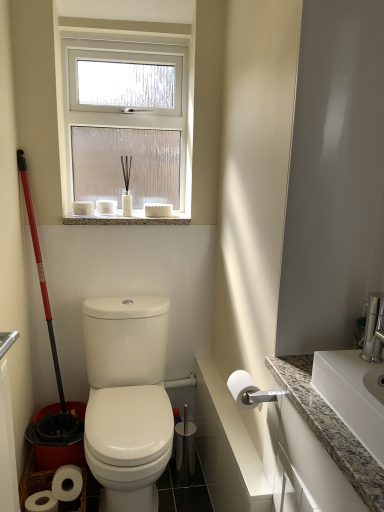
Question: From the image's perspective, is white glossy toilet at center over clear glass window at upper center?

Choices:
 (A) yes
 (B) no

Answer: (B)

Question: From a real-world perspective, is white glossy toilet at center located higher than clear glass window at upper center?

Choices:
 (A) yes
 (B) no

Answer: (B)

Question: Is white glossy toilet at center outside of clear glass window at upper center?

Choices:
 (A) no
 (B) yes

Answer: (B)

Question: Does white glossy toilet at center have a lesser width compared to clear glass window at upper center?

Choices:
 (A) yes
 (B) no

Answer: (B)

Question: From the image's perspective, is white glossy toilet at center below clear glass window at upper center?

Choices:
 (A) no
 (B) yes

Answer: (B)

Question: From the image's perspective, is white matte toilet paper at upper center, the 1th toilet paper in the left-to-right sequence, above or below granite at upper center?

Choices:
 (A) below
 (B) above

Answer: (B)

Question: Is white matte toilet paper at upper center, which appears as the third toilet paper when viewed from the right, wider or thinner than granite at upper center?

Choices:
 (A) wide
 (B) thin

Answer: (B)

Question: Is point (86, 214) positioned closer to the camera than point (147, 218)?

Choices:
 (A) farther
 (B) closer

Answer: (A)

Question: Is white matte toilet paper at upper center, marked as the 3th toilet paper in a bottom-to-top arrangement, bigger or smaller than granite at upper center?

Choices:
 (A) big
 (B) small

Answer: (B)

Question: Would you say white glossy toilet at center is to the left or to the right of white matte toilet paper at upper center, the second toilet paper viewed from the left, in the picture?

Choices:
 (A) right
 (B) left

Answer: (A)

Question: From the image's perspective, is white glossy toilet at center positioned above or below white matte toilet paper at upper center, the second toilet paper in the bottom-to-top sequence?

Choices:
 (A) below
 (B) above

Answer: (A)

Question: From a real-world perspective, is white glossy toilet at center physically located above or below white matte toilet paper at upper center, the second toilet paper viewed from the left?

Choices:
 (A) below
 (B) above

Answer: (A)

Question: Is white glossy toilet at center taller or shorter than white matte toilet paper at upper center, the second toilet paper in the bottom-to-top sequence?

Choices:
 (A) tall
 (B) short

Answer: (A)

Question: Is white glossy toilet at center wider or thinner than granite at upper center?

Choices:
 (A) thin
 (B) wide

Answer: (B)

Question: Is point (84, 326) closer or farther from the camera than point (160, 222)?

Choices:
 (A) closer
 (B) farther

Answer: (A)